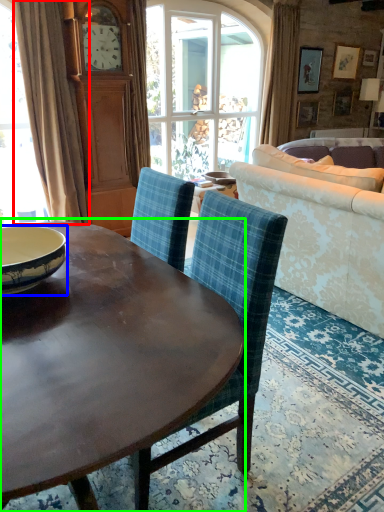
Question: Which object is positioned farthest from curtain (highlighted by a red box)? Select from bowl (highlighted by a blue box) and coffee table (highlighted by a green box).

Choices:
 (A) bowl
 (B) coffee table

Answer: (B)